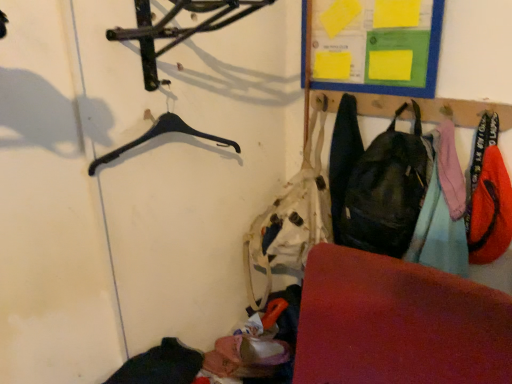
Find the location of `black plastic hanger at upper left`. black plastic hanger at upper left is located at coordinates (160, 134).

The width and height of the screenshot is (512, 384). I want to click on matte black backpack at center-right, which is counted as the 1th clothing, starting from the left, so click(x=343, y=158).

What is the approximate width of yellow paper at upper right?

It is 1.83 inches.

In order to click on matte black backpack at right in this screenshot , I will do `click(386, 191)`.

From a real-world perspective, who is located higher, black plastic hanger at upper left or matte black backpack at center-right, the 3th clothing viewed from the right?

black plastic hanger at upper left.

From the image's perspective, does black plastic hanger at upper left appear lower than matte black backpack at center-right, the 3th clothing viewed from the right?

No.

Is black plastic hanger at upper left surrounding matte black backpack at center-right, which is counted as the 1th clothing, starting from the left?

No, matte black backpack at center-right, which is counted as the 1th clothing, starting from the left, is not inside black plastic hanger at upper left.

Considering the sizes of objects black plastic hanger at upper left and matte black backpack at center-right, the 3th clothing viewed from the right, in the image provided, who is smaller, black plastic hanger at upper left or matte black backpack at center-right, the 3th clothing viewed from the right,?

black plastic hanger at upper left.

Would you say black plastic hanger at upper left is inside or outside orange fabric pants at right, the second clothing positioned from the right?

black plastic hanger at upper left is spatially situated outside orange fabric pants at right, the second clothing positioned from the right.

Can you confirm if black plastic hanger at upper left is positioned to the left of orange fabric pants at right, the second clothing positioned from the right?

Yes.

Does black plastic hanger at upper left have a greater width compared to orange fabric pants at right, the second clothing positioned from the right?

No, black plastic hanger at upper left is not wider than orange fabric pants at right, the second clothing positioned from the right.

Is the depth of black plastic hanger at upper left greater than that of orange fabric pants at right, the second clothing positioned from the right?

No, it is in front of orange fabric pants at right, the second clothing positioned from the right.

In the scene shown: Does yellow paper at upper right have a greater width compared to matte black backpack at right?

No.

Locate an element on the screen. The image size is (512, 384). bulletin board above the matte black backpack at right (from the image's perspective) is located at coordinates (373, 46).

Considering the positions of point (392, 86) and point (409, 152), is point (392, 86) closer or farther from the camera than point (409, 152)?

Point (392, 86) is positioned farther from the camera compared to point (409, 152).

Is orange fabric pants at right, the second clothing positioned from the right, not near matte black backpack at right?

No, orange fabric pants at right, the second clothing positioned from the right, is not far from matte black backpack at right.

From the image's perspective, which object appears higher, orange fabric pants at right, the second clothing positioned from the left, or matte black backpack at right?

matte black backpack at right.

Who is shorter, orange fabric pants at right, the second clothing positioned from the left, or matte black backpack at right?

matte black backpack at right is shorter.

Would you say matte black backpack at right is part of orange fabric pants at right, the second clothing positioned from the left,'s contents?

Definitely not — matte black backpack at right is not inside orange fabric pants at right, the second clothing positioned from the left.

Based on their sizes in the image, would you say rubberized red mat at lower right is bigger or smaller than matte black backpack at center-right, which is counted as the 1th clothing, starting from the left?

rubberized red mat at lower right is bigger than matte black backpack at center-right, which is counted as the 1th clothing, starting from the left.

Is rubberized red mat at lower right oriented towards matte black backpack at center-right, which is counted as the 1th clothing, starting from the left?

No, rubberized red mat at lower right is not facing towards matte black backpack at center-right, which is counted as the 1th clothing, starting from the left.

Between rubberized red mat at lower right and matte black backpack at center-right, the 3th clothing viewed from the right, which one is positioned in front?

rubberized red mat at lower right.

From a real-world perspective, is rubberized red mat at lower right positioned over matte black backpack at center-right, which is counted as the 1th clothing, starting from the left, based on gravity?

No.

Based on the photo, is matte black backpack at right surrounding matte black backpack at center-right, the 3th clothing viewed from the right?

No, matte black backpack at center-right, the 3th clothing viewed from the right, is not surrounded by matte black backpack at right.

Between point (377, 213) and point (340, 132), which one is positioned in front?

The point (377, 213) is more forward.

From the image's perspective, between matte black backpack at right and matte black backpack at center-right, the 3th clothing viewed from the right, which one is located above?

From the image's view, matte black backpack at center-right, the 3th clothing viewed from the right, is above.

Considering the positions of objects matte black backpack at right and matte black backpack at center-right, the 3th clothing viewed from the right, in the image provided, who is more to the right, matte black backpack at right or matte black backpack at center-right, the 3th clothing viewed from the right,?

matte black backpack at right.

Is rubberized red mat at lower right in front of or behind matte black backpack at right in the image?

rubberized red mat at lower right is in front of matte black backpack at right.

Is rubberized red mat at lower right wider than matte black backpack at right?

Indeed, rubberized red mat at lower right has a greater width compared to matte black backpack at right.

Where is `the 3rd clothing behind when counting from the black plastic hanger at upper left`? Image resolution: width=512 pixels, height=384 pixels. the 3rd clothing behind when counting from the black plastic hanger at upper left is located at coordinates (343, 158).

From the image's perspective, which clothing is the 2nd one below the black plastic hanger at upper left? Please provide its 2D coordinates.

[(442, 210)]

Which object lies further to the anchor point orange fabric bag at right, marked as the first clothing in a right-to-left arrangement, rubberized red mat at lower right or orange fabric pants at right, the second clothing positioned from the left?

Among the two, rubberized red mat at lower right is located further to orange fabric bag at right, marked as the first clothing in a right-to-left arrangement.

Considering their positions, is matte black backpack at center-right, the 3th clothing viewed from the right, positioned closer to matte black backpack at right than orange fabric bag at right, marked as the first clothing in a right-to-left arrangement?

Based on the image, matte black backpack at center-right, the 3th clothing viewed from the right, appears to be nearer to matte black backpack at right.

From the image, which object appears to be farther from black plastic hanger at upper left, orange fabric pants at right, the second clothing positioned from the right, or matte black backpack at right?

orange fabric pants at right, the second clothing positioned from the right.

From the image, which object appears to be nearer to yellow paper at upper right, rubberized red mat at lower right or orange fabric bag at right, marked as the third clothing in a left-to-right arrangement?

The object closer to yellow paper at upper right is orange fabric bag at right, marked as the third clothing in a left-to-right arrangement.

Looking at the image, which one is located closer to black plastic hanger at upper left, yellow paper at upper right or matte black backpack at center-right, which is counted as the 1th clothing, starting from the left?

Based on the image, matte black backpack at center-right, which is counted as the 1th clothing, starting from the left, appears to be nearer to black plastic hanger at upper left.

Looking at the image, which one is located closer to matte black backpack at right, rubberized red mat at lower right or black plastic hanger at upper left?

The object closer to matte black backpack at right is rubberized red mat at lower right.

Based on their spatial positions, is matte black backpack at right or yellow paper at upper right closer to rubberized red mat at lower right?

matte black backpack at right is positioned closer to the anchor rubberized red mat at lower right.

Based on their spatial positions, is matte black backpack at center-right, which is counted as the 1th clothing, starting from the left, or yellow paper at upper right further from orange fabric bag at right, marked as the third clothing in a left-to-right arrangement?

Based on the image, matte black backpack at center-right, which is counted as the 1th clothing, starting from the left, appears to be further to orange fabric bag at right, marked as the third clothing in a left-to-right arrangement.

Locate an element on the screen. bulletin board between black plastic hanger at upper left and matte black backpack at right in the horizontal direction is located at coordinates (373, 46).

Where is `shoulder bag between rubberized red mat at lower right and matte black backpack at center-right, the 3th clothing viewed from the right, in the front-back direction`? This screenshot has height=384, width=512. shoulder bag between rubberized red mat at lower right and matte black backpack at center-right, the 3th clothing viewed from the right, in the front-back direction is located at coordinates (386, 191).

This screenshot has height=384, width=512. In order to click on bulletin board between black plastic hanger at upper left and orange fabric pants at right, the second clothing positioned from the right, from left to right in this screenshot , I will do `click(373, 46)`.

Identify the location of furniture situated between black plastic hanger at upper left and orange fabric bag at right, marked as the third clothing in a left-to-right arrangement, from left to right. The image size is (512, 384). (398, 323).